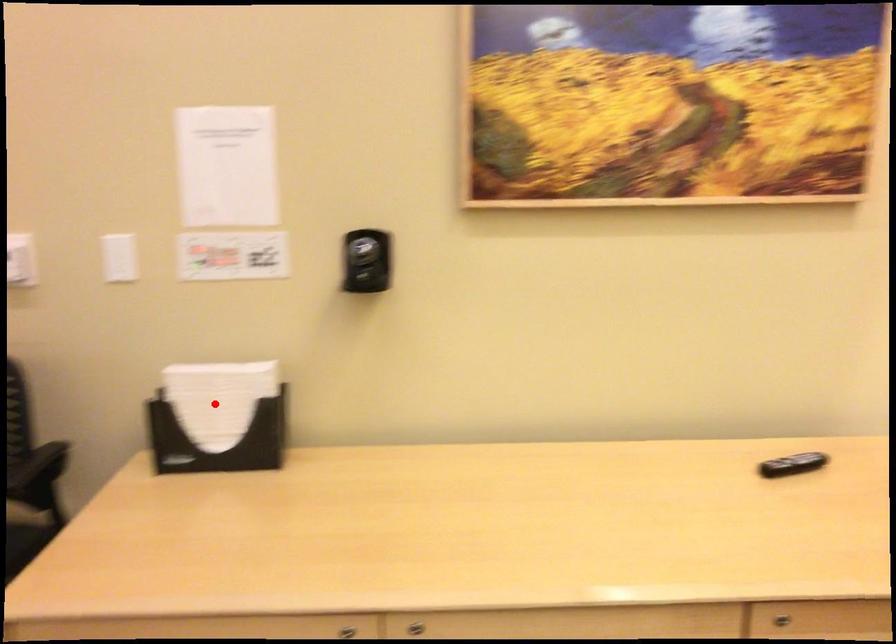
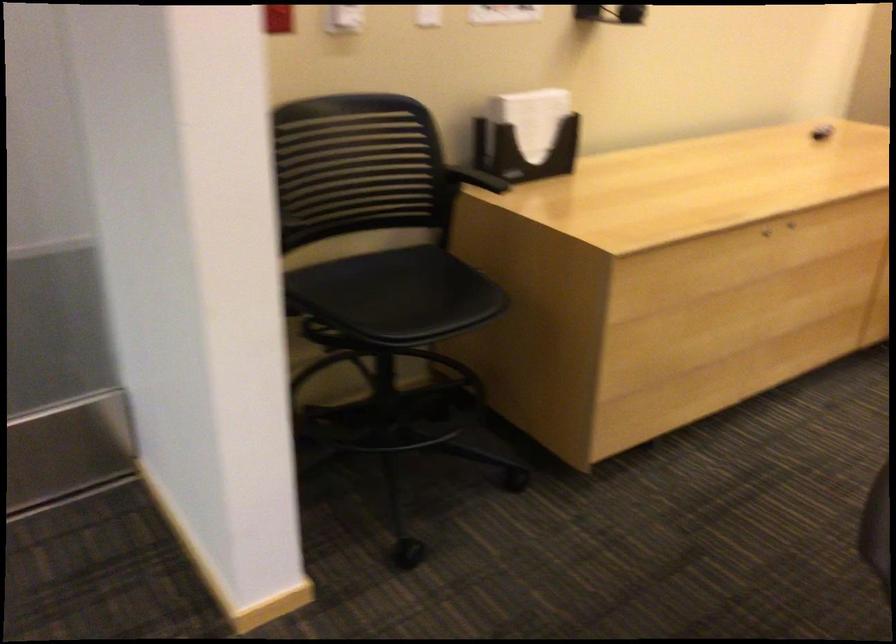
Question: I am providing you with two images of the same scene from different viewpoints. A red point is shown in image1. For the corresponding object point in image2, is it positioned nearer or farther from the camera?

Choices:
 (A) Nearer
 (B) Farther

Answer: (B)